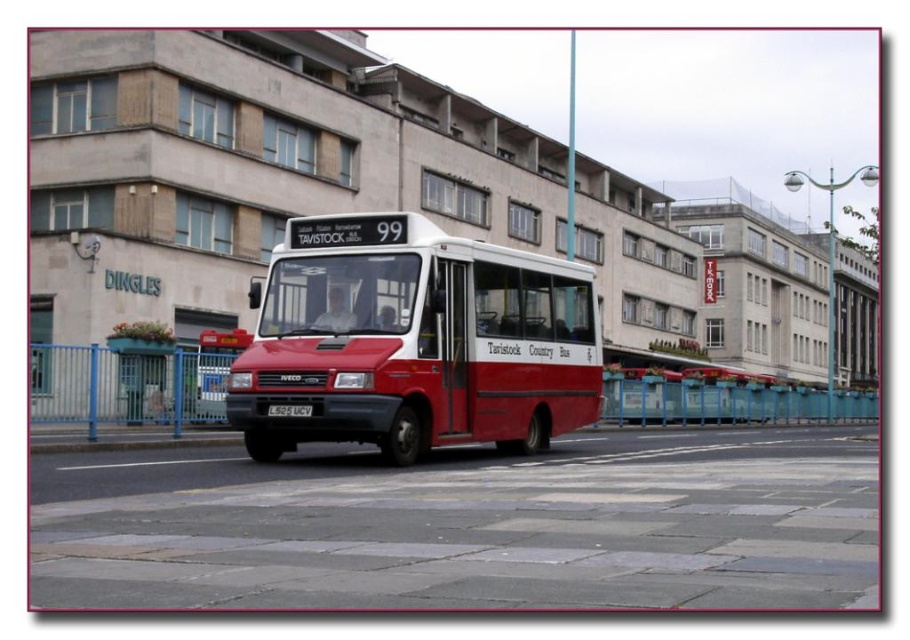
Can you confirm if matte red bus at center is bigger than black plastic license plate at center?

Indeed, matte red bus at center has a larger size compared to black plastic license plate at center.

Does matte red bus at center have a smaller size compared to black plastic license plate at center?

No.

In order to click on matte red bus at center in this screenshot , I will do `click(413, 340)`.